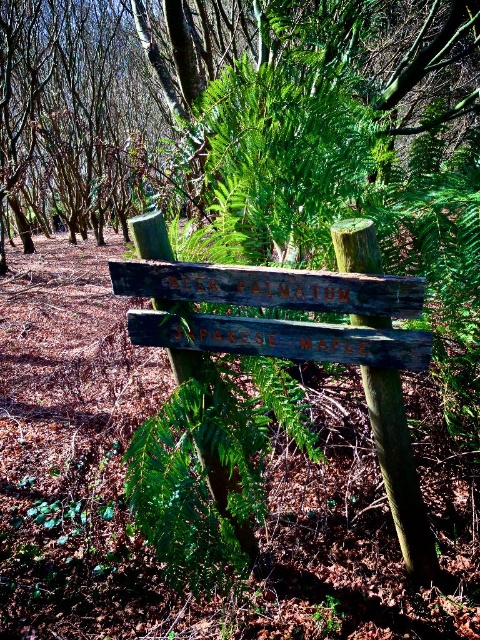
Question: Which object is farther from the camera taking this photo?

Choices:
 (A) green wood sign at center
 (B) weathered wood sign at center

Answer: (A)

Question: Is green wood sign at center to the right of weathered wood sign at center from the viewer's perspective?

Choices:
 (A) yes
 (B) no

Answer: (B)

Question: In this image, where is green wood sign at center located relative to weathered wood sign at center?

Choices:
 (A) below
 (B) above

Answer: (B)

Question: Is green wood sign at center further to the viewer compared to weathered wood sign at center?

Choices:
 (A) yes
 (B) no

Answer: (A)

Question: Which point is farther to the camera?

Choices:
 (A) (250, 22)
 (B) (423, 509)

Answer: (A)